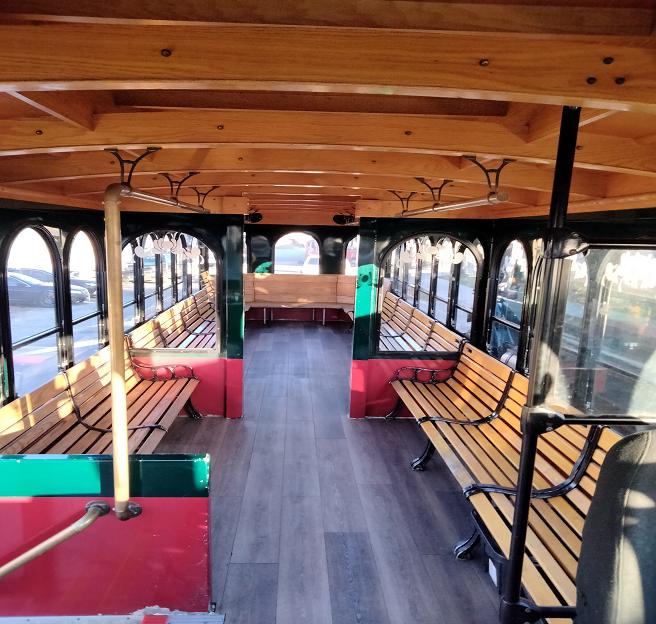
In order to click on stair railing in this screenshot , I will do `click(73, 527)`.